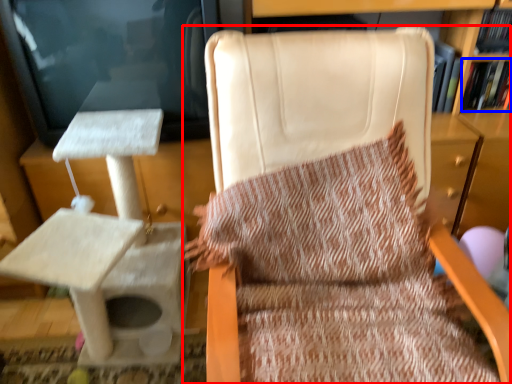
Question: Which object is further to the camera taking this photo, chair (highlighted by a red box) or book (highlighted by a blue box)?

Choices:
 (A) chair
 (B) book

Answer: (B)